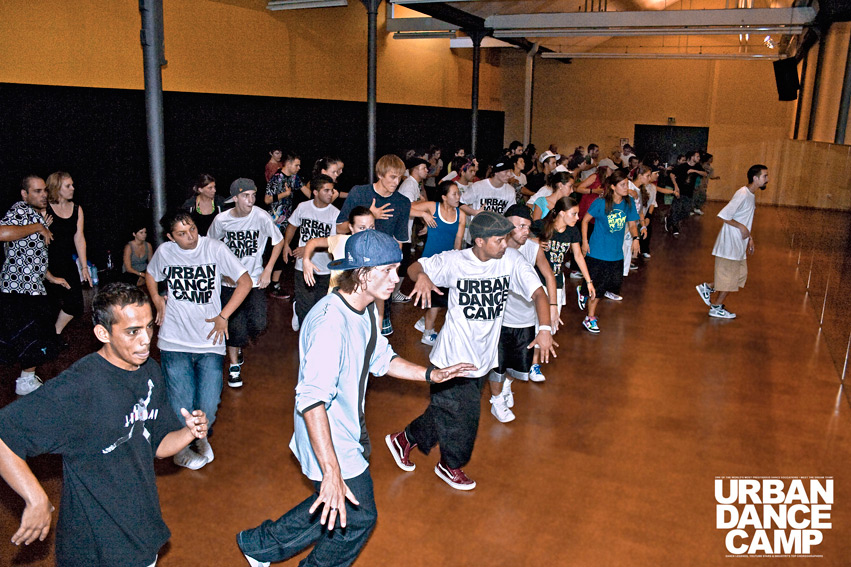
I want to click on door, so click(658, 135).